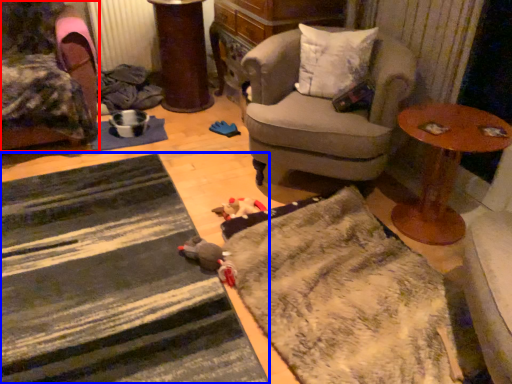
Question: Which of the following is the closest to the observer, chair (highlighted by a red box) or doormat (highlighted by a blue box)?

Choices:
 (A) chair
 (B) doormat

Answer: (B)